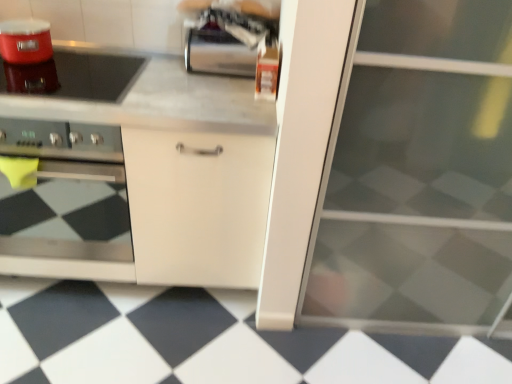
Question: From the image's perspective, is white matte cabinet at center below stainless steel oven at left?

Choices:
 (A) yes
 (B) no

Answer: (A)

Question: Is white matte cabinet at center oriented towards stainless steel oven at left?

Choices:
 (A) yes
 (B) no

Answer: (A)

Question: Is white matte cabinet at center thinner than stainless steel oven at left?

Choices:
 (A) no
 (B) yes

Answer: (A)

Question: Is white matte cabinet at center far away from stainless steel oven at left?

Choices:
 (A) no
 (B) yes

Answer: (A)

Question: Is white matte cabinet at center to the right of stainless steel oven at left from the viewer's perspective?

Choices:
 (A) yes
 (B) no

Answer: (A)

Question: Looking at their shapes, would you say black glossy tile at lower center is wider or thinner than matte red rice cooker at upper left?

Choices:
 (A) thin
 (B) wide

Answer: (B)

Question: Considering the positions of point (286, 370) and point (23, 56), is point (286, 370) closer or farther from the camera than point (23, 56)?

Choices:
 (A) closer
 (B) farther

Answer: (B)

Question: Is black glossy tile at lower center inside the boundaries of matte red rice cooker at upper left, or outside?

Choices:
 (A) outside
 (B) inside

Answer: (A)

Question: From the image's perspective, relative to matte red rice cooker at upper left, is black glossy tile at lower center above or below?

Choices:
 (A) above
 (B) below

Answer: (B)

Question: Considering their positions, is white matte cabinet at center located in front of or behind stainless steel oven at left?

Choices:
 (A) front
 (B) behind

Answer: (A)

Question: Looking at their shapes, would you say white matte cabinet at center is wider or thinner than stainless steel oven at left?

Choices:
 (A) wide
 (B) thin

Answer: (A)

Question: Is white matte cabinet at center situated inside stainless steel oven at left or outside?

Choices:
 (A) outside
 (B) inside

Answer: (A)

Question: From a real-world perspective, is white matte cabinet at center physically located above or below stainless steel oven at left?

Choices:
 (A) above
 (B) below

Answer: (B)

Question: Is matte red rice cooker at upper left in front of or behind satin metallic paper towel holder at upper center in the image?

Choices:
 (A) front
 (B) behind

Answer: (A)

Question: From the image's perspective, relative to satin metallic paper towel holder at upper center, is matte red rice cooker at upper left above or below?

Choices:
 (A) below
 (B) above

Answer: (B)